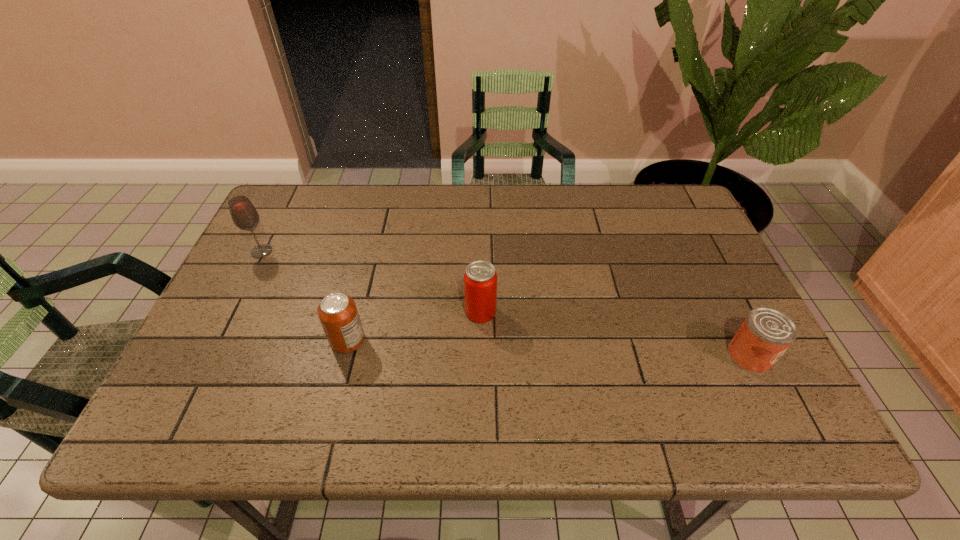
I want to click on vacant area that lies between the glass drink container and the farthest can, so click(x=372, y=282).

This screenshot has height=540, width=960. In order to click on empty location between the leftmost can and the rightmost can in this screenshot , I will do (548, 348).

Find the location of a particular element. This screenshot has width=960, height=540. empty space that is in between the leftmost can and the leftmost object is located at coordinates (304, 296).

Where is `empty space that is in between the third nearest object and the shortest can`? empty space that is in between the third nearest object and the shortest can is located at coordinates (615, 334).

Where is `free spot between the farthest can and the tallest object`? The width and height of the screenshot is (960, 540). free spot between the farthest can and the tallest object is located at coordinates (372, 282).

Find the location of `free spot between the leftmost can and the rightmost can`. free spot between the leftmost can and the rightmost can is located at coordinates (548, 348).

Locate an element on the screen. This screenshot has width=960, height=540. unoccupied area between the farthest object and the second farthest object is located at coordinates (372, 282).

The image size is (960, 540). In order to click on free space between the glass drink container and the rightmost can in this screenshot , I will do point(506,304).

In order to click on free area in between the rightmost object and the leftmost object in this screenshot , I will do `click(506, 304)`.

This screenshot has width=960, height=540. Find the location of `free space between the farthest object and the second can from left to right`. free space between the farthest object and the second can from left to right is located at coordinates (372, 282).